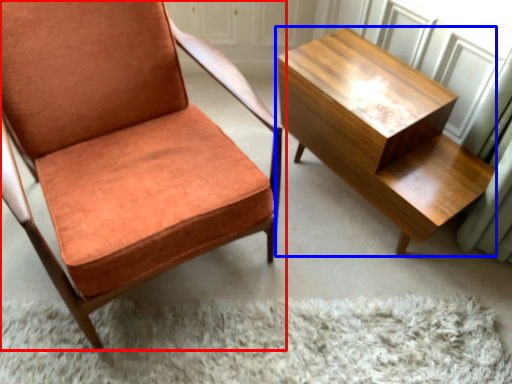
Question: Which object is closer to the camera taking this photo, chair (highlighted by a red box) or table (highlighted by a blue box)?

Choices:
 (A) chair
 (B) table

Answer: (A)